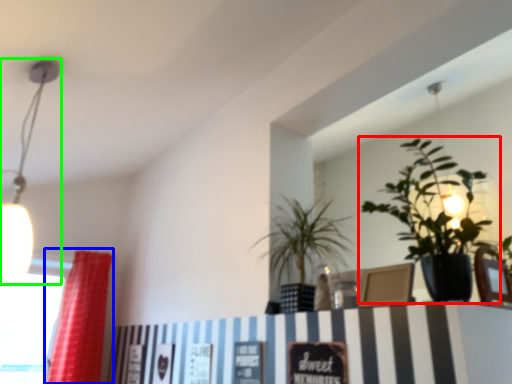
Question: Which is farther away from houseplant (highlighted by a red box)? curtain (highlighted by a blue box) or lamp (highlighted by a green box)?

Choices:
 (A) curtain
 (B) lamp

Answer: (A)